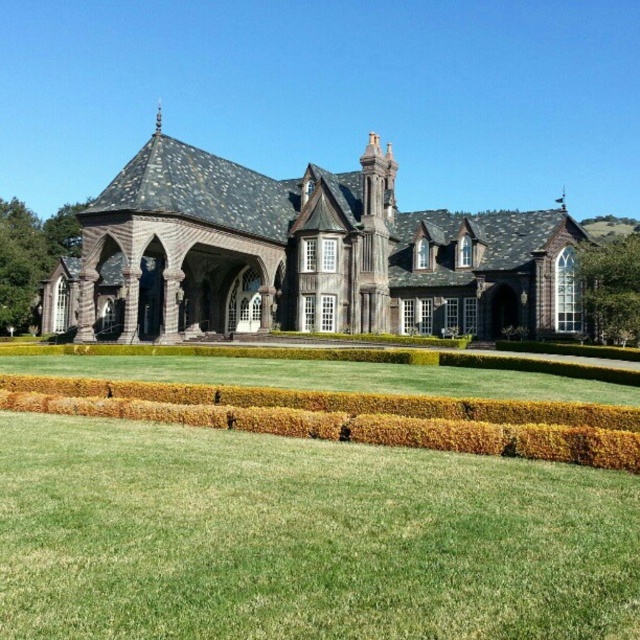
Question: Considering the real-world distances, which object is closest to the green grass at center?

Choices:
 (A) green textured hedge at lower center
 (B) wooden church at center

Answer: (A)

Question: Which point is closer to the camera?

Choices:
 (A) green grass at center
 (B) green textured hedge at lower center
 (C) wooden church at center

Answer: (A)

Question: Does green grass at center have a larger size compared to green textured hedge at lower center?

Choices:
 (A) yes
 (B) no

Answer: (A)

Question: Is green grass at center below green textured hedge at lower center?

Choices:
 (A) yes
 (B) no

Answer: (A)

Question: Is wooden church at center bigger than green textured hedge at lower center?

Choices:
 (A) no
 (B) yes

Answer: (B)

Question: Which object is farther from the camera taking this photo?

Choices:
 (A) green grass at center
 (B) wooden church at center

Answer: (B)